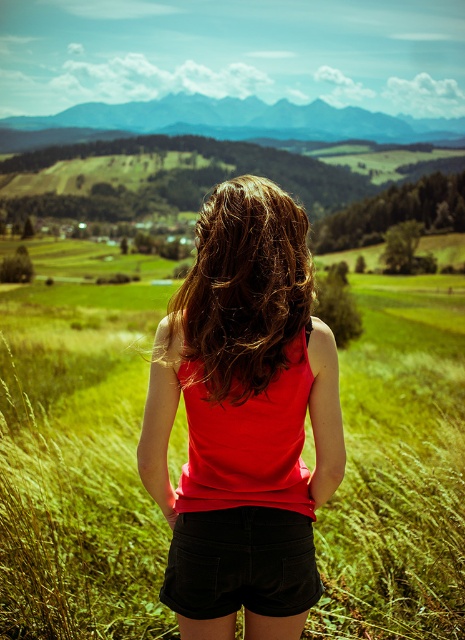
You are a fashion designer observing the person in the scene. You need to determine if the matte red tank top at center will cover the black denim shorts at center based on their sizes. Can you confirm?

The matte red tank top at center is taller than the black denim shorts at center, so the tank top will cover the shorts.